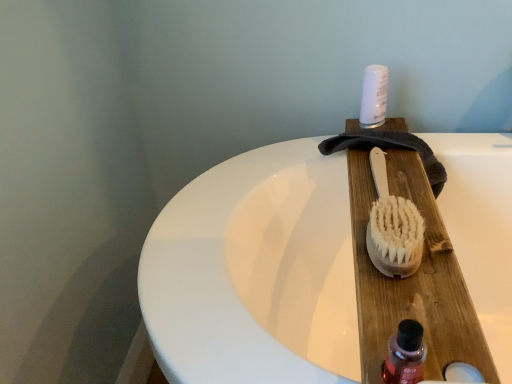
You are a GUI agent. You are given a task and a screenshot of the screen. Output one action in this format:
    pyautogui.click(x=<x>, y=<y>)
    Task: Click on the empty space that is in between natural wood brush at center and translucent plastic bottle at lower right
    
    Given the screenshot: What is the action you would take?
    pyautogui.click(x=400, y=301)